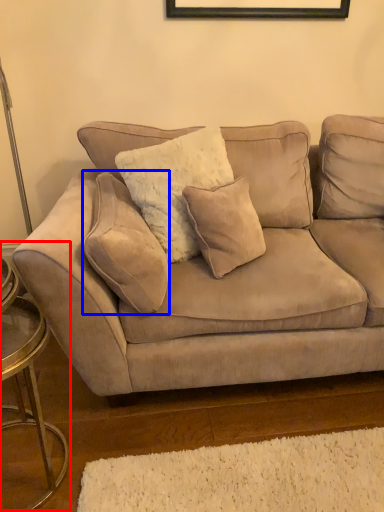
Question: Which object appears closest to the camera in this image, side table (highlighted by a red box) or pillow (highlighted by a blue box)?

Choices:
 (A) side table
 (B) pillow

Answer: (A)